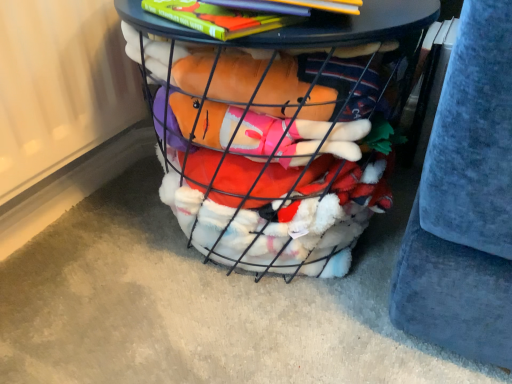
Question: Is wire mesh basket at center oriented away from hardcover book at upper center?

Choices:
 (A) yes
 (B) no

Answer: (B)

Question: Considering the relative sizes of wire mesh basket at center and hardcover book at upper center in the image provided, is wire mesh basket at center shorter than hardcover book at upper center?

Choices:
 (A) yes
 (B) no

Answer: (B)

Question: Considering the relative sizes of wire mesh basket at center and hardcover book at upper center in the image provided, is wire mesh basket at center thinner than hardcover book at upper center?

Choices:
 (A) yes
 (B) no

Answer: (B)

Question: Can you confirm if wire mesh basket at center is bigger than hardcover book at upper center?

Choices:
 (A) no
 (B) yes

Answer: (B)

Question: Considering the relative sizes of wire mesh basket at center and hardcover book at upper center in the image provided, is wire mesh basket at center smaller than hardcover book at upper center?

Choices:
 (A) no
 (B) yes

Answer: (A)

Question: Is hardcover book at upper center completely or partially inside wire mesh basket at center?

Choices:
 (A) yes
 (B) no

Answer: (B)

Question: Considering the relative sizes of velvety blue cushion at right and wire mesh basket at center in the image provided, is velvety blue cushion at right shorter than wire mesh basket at center?

Choices:
 (A) no
 (B) yes

Answer: (A)

Question: Is velvety blue cushion at right smaller than wire mesh basket at center?

Choices:
 (A) yes
 (B) no

Answer: (A)

Question: Is velvety blue cushion at right located outside wire mesh basket at center?

Choices:
 (A) no
 (B) yes

Answer: (B)

Question: Does velvety blue cushion at right have a greater width compared to wire mesh basket at center?

Choices:
 (A) yes
 (B) no

Answer: (A)

Question: Is velvety blue cushion at right to the right of wire mesh basket at center from the viewer's perspective?

Choices:
 (A) yes
 (B) no

Answer: (A)

Question: Does velvety blue cushion at right contain wire mesh basket at center?

Choices:
 (A) yes
 (B) no

Answer: (B)

Question: Is hardcover book at upper center facing away from wire mesh basket at center?

Choices:
 (A) yes
 (B) no

Answer: (B)